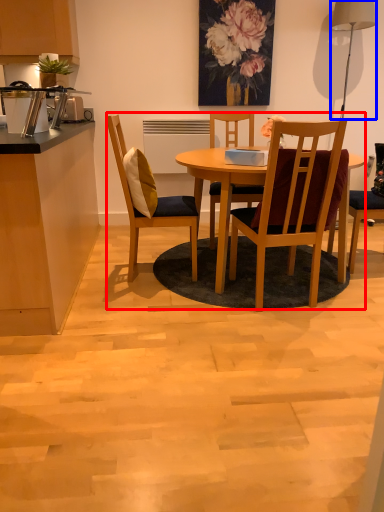
Question: Which object appears farthest to the camera in this image, kitchen & dining room table (highlighted by a red box) or lamp (highlighted by a blue box)?

Choices:
 (A) kitchen & dining room table
 (B) lamp

Answer: (B)